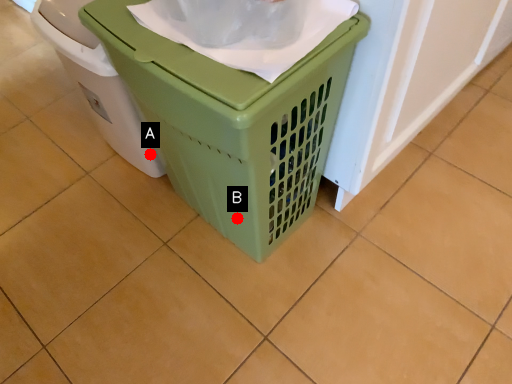
Question: Two points are circled on the image, labeled by A and B beside each circle. Which point is closer to the camera?

Choices:
 (A) A is closer
 (B) B is closer

Answer: (B)